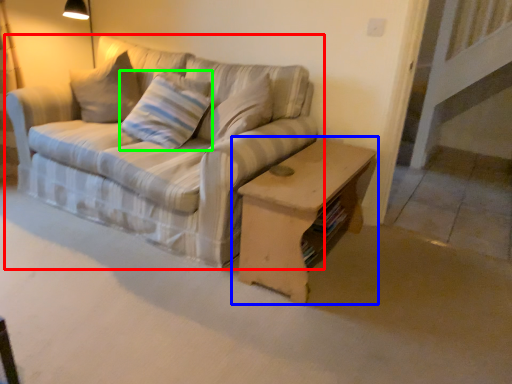
Question: Estimate the real-world distances between objects in this image. Which object is closer to studio couch (highlighted by a red box), table (highlighted by a blue box) or pillow (highlighted by a green box)?

Choices:
 (A) table
 (B) pillow

Answer: (B)